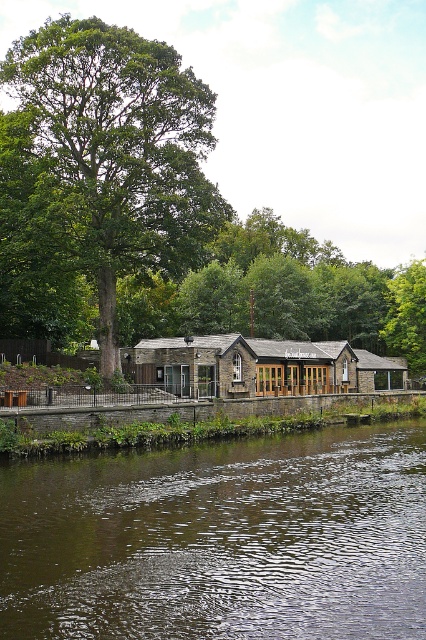
Measure the distance between green leafy tree at center and brown stone building at center.

green leafy tree at center is 14.13 meters away from brown stone building at center.

Is green leafy tree at center below brown stone building at center?

No.

Which is in front, point (195, 211) or point (236, 378)?

Point (236, 378) is more forward.

Locate an element on the screen. This screenshot has height=640, width=426. green leafy tree at center is located at coordinates (120, 148).

Who is higher up, brown liquid water at lower center or brown stone building at center?

brown stone building at center

Does brown liquid water at lower center have a larger size compared to brown stone building at center?

No, brown liquid water at lower center is not bigger than brown stone building at center.

Identify the location of brown liquid water at lower center. (221, 540).

Is point (244, 353) farther from camera compared to point (400, 332)?

No, it is in front of (400, 332).

Is point (270, 390) in front of point (408, 346)?

Yes, it is in front of point (408, 346).

At what (x,y) coordinates should I click in order to perform the action: click on brown stone building at center. Please return your answer as a coordinate pair (x, y). The width and height of the screenshot is (426, 640). Looking at the image, I should click on (258, 365).